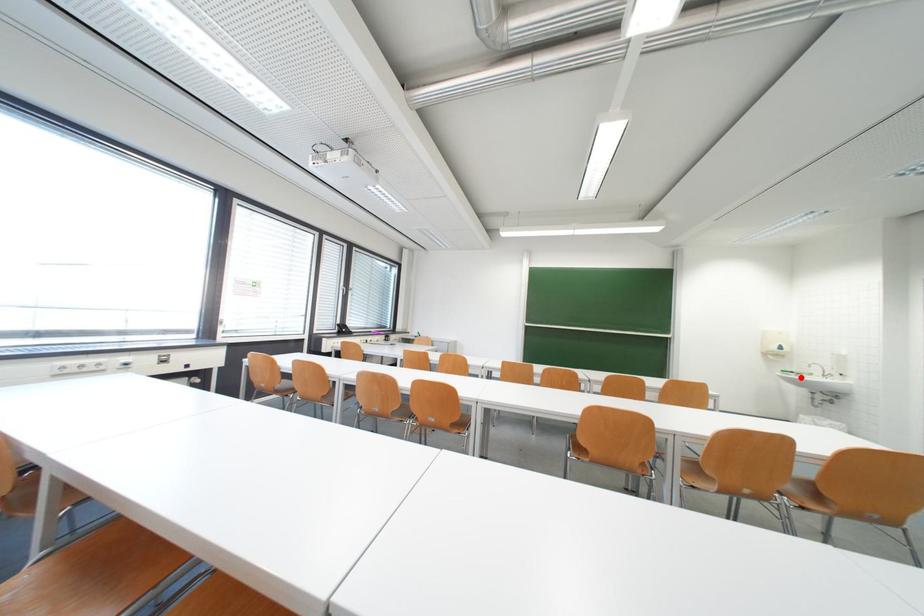
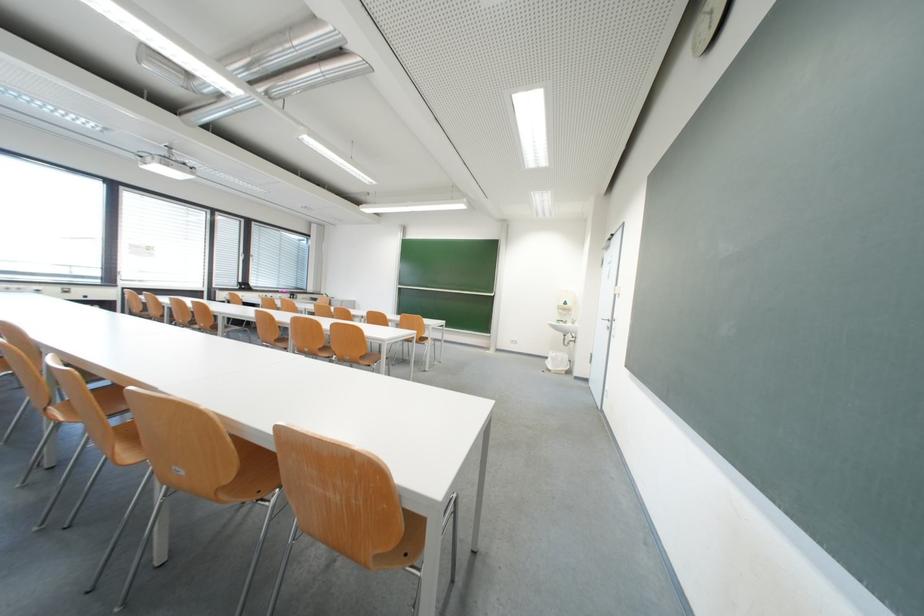
Where in the second image is the point corresponding to the highlighted location from the first image?

(570, 326)